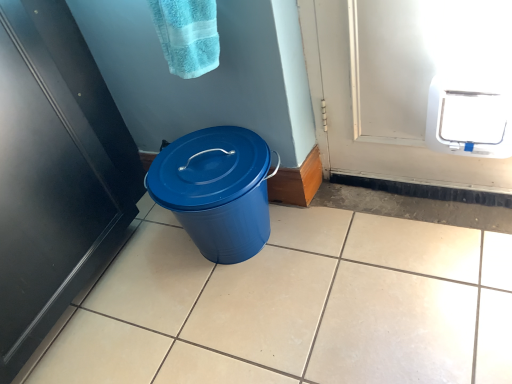
Question: Is black matte door at left bigger than white plastic pet door at upper right?

Choices:
 (A) yes
 (B) no

Answer: (A)

Question: Is there a large distance between black matte door at left and white plastic pet door at upper right?

Choices:
 (A) yes
 (B) no

Answer: (A)

Question: Is black matte door at left next to white plastic pet door at upper right and touching it?

Choices:
 (A) yes
 (B) no

Answer: (B)

Question: Is black matte door at left turned away from white plastic pet door at upper right?

Choices:
 (A) yes
 (B) no

Answer: (B)

Question: Is black matte door at left taller than white plastic pet door at upper right?

Choices:
 (A) no
 (B) yes

Answer: (B)

Question: Is black matte door at left further to camera compared to white plastic pet door at upper right?

Choices:
 (A) no
 (B) yes

Answer: (A)

Question: Can you confirm if turquoise terry cloth towel at upper center is shorter than black matte door at left?

Choices:
 (A) no
 (B) yes

Answer: (B)

Question: Considering the relative positions of turquoise terry cloth towel at upper center and black matte door at left in the image provided, is turquoise terry cloth towel at upper center to the left of black matte door at left from the viewer's perspective?

Choices:
 (A) yes
 (B) no

Answer: (B)

Question: Is turquoise terry cloth towel at upper center thinner than black matte door at left?

Choices:
 (A) no
 (B) yes

Answer: (B)

Question: Is there a large distance between turquoise terry cloth towel at upper center and black matte door at left?

Choices:
 (A) no
 (B) yes

Answer: (A)

Question: From a real-world perspective, does turquoise terry cloth towel at upper center stand above black matte door at left?

Choices:
 (A) yes
 (B) no

Answer: (A)

Question: Does turquoise terry cloth towel at upper center touch black matte door at left?

Choices:
 (A) yes
 (B) no

Answer: (B)

Question: From the image's perspective, does white plastic pet door at upper right appear higher than black matte door at left?

Choices:
 (A) no
 (B) yes

Answer: (B)